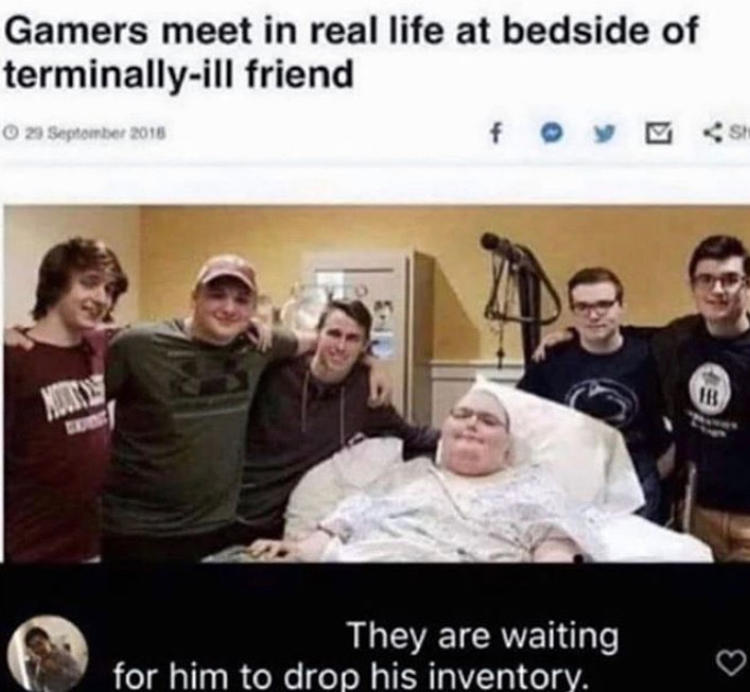
The height and width of the screenshot is (692, 750). Find the location of `white pillow`. white pillow is located at coordinates point(578,455).